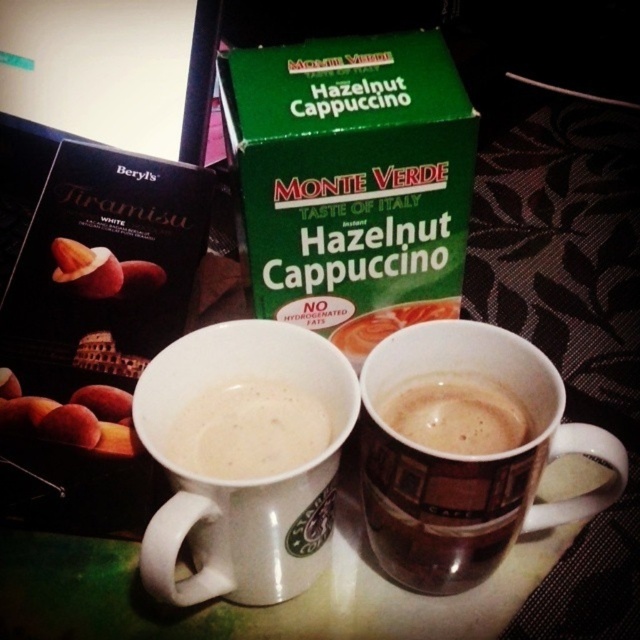
Describe the element at coordinates (467, 460) in the screenshot. I see `brown ceramic mug at center` at that location.

Between point (365, 394) and point (321, 426), which one is positioned behind?

The point (321, 426) is behind.

I want to click on brown ceramic mug at center, so click(467, 460).

Which of these two, brown ceramic mug at center or brown matte cup at center, stands shorter?

Standing shorter between the two is brown matte cup at center.

Between point (429, 476) and point (419, 387), which one is positioned behind?

The point (419, 387) is more distant.

Where is `brown ceramic mug at center`? Image resolution: width=640 pixels, height=640 pixels. brown ceramic mug at center is located at coordinates (467, 460).

Does white matte mug at center appear on the right side of brown matte cup at center?

Incorrect, white matte mug at center is not on the right side of brown matte cup at center.

How distant is white matte mug at center from brown matte cup at center?

A distance of 3.18 inches exists between white matte mug at center and brown matte cup at center.

Where is `white matte mug at center`? The image size is (640, 640). white matte mug at center is located at coordinates (248, 429).